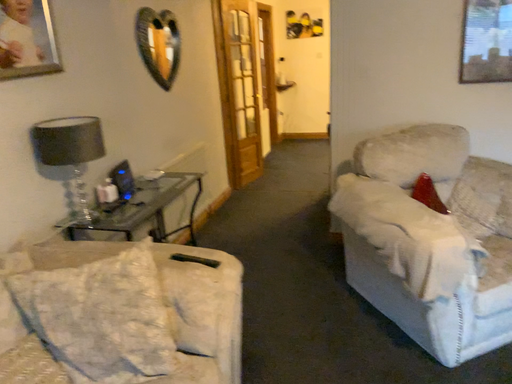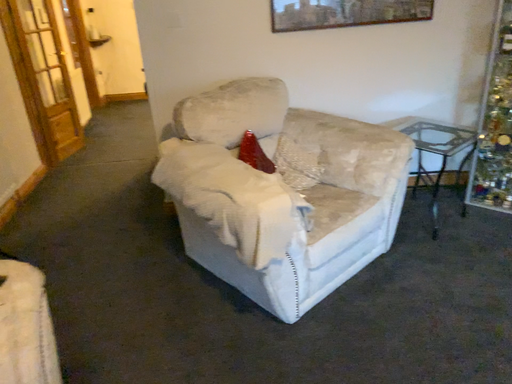
Question: Which way did the camera rotate in the video?

Choices:
 (A) rotated left
 (B) rotated right

Answer: (B)